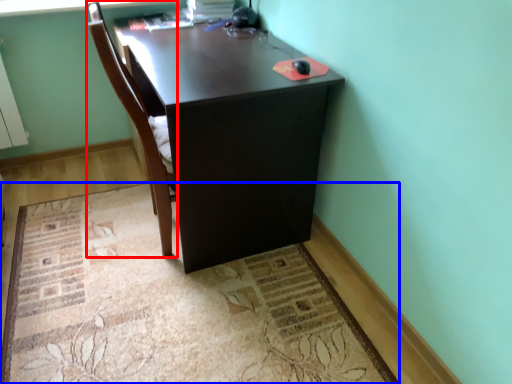
Question: Which of the following is the closest to the observer, chair (highlighted by a red box) or mat (highlighted by a blue box)?

Choices:
 (A) chair
 (B) mat

Answer: (B)